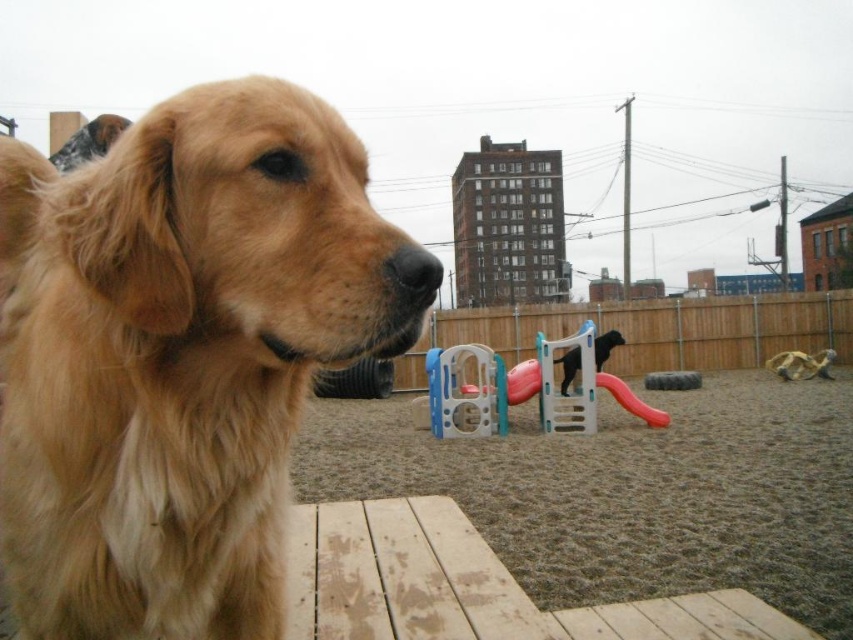
Question: Does plastic slide at center appear on the right side of brown fur dog at upper left?

Choices:
 (A) yes
 (B) no

Answer: (A)

Question: Estimate the real-world distances between objects in this image. Which object is closer to the brown gravel at center?

Choices:
 (A) plastic slide at center
 (B) black rubber dog at center
 (C) brown fur dog at upper left

Answer: (B)

Question: Which point is closer to the camera?

Choices:
 (A) (71, 150)
 (B) (469, 388)
 (C) (807, 378)
 (D) (728, 477)

Answer: (A)

Question: Where is rubber rope toy at lower right located in relation to black rubber dog at center in the image?

Choices:
 (A) above
 (B) below

Answer: (B)

Question: Does brown gravel at center appear under black rubber dog at center?

Choices:
 (A) no
 (B) yes

Answer: (B)

Question: Which point is farther to the camera?

Choices:
 (A) black rubber dog at center
 (B) plastic slide at center
 (C) golden fur dog at left

Answer: (A)